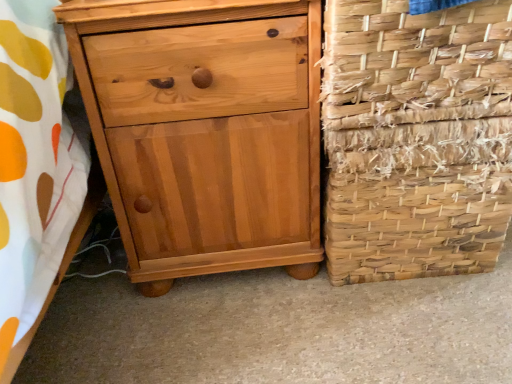
Question: Does light brown wood chest of drawers at left have a lesser width compared to woven natural fiber basket at right?

Choices:
 (A) yes
 (B) no

Answer: (B)

Question: Is light brown wood chest of drawers at left positioned before woven natural fiber basket at right?

Choices:
 (A) yes
 (B) no

Answer: (A)

Question: From the image's perspective, does light brown wood chest of drawers at left appear higher than woven natural fiber basket at right?

Choices:
 (A) yes
 (B) no

Answer: (A)

Question: Does light brown wood chest of drawers at left appear on the left side of woven natural fiber basket at right?

Choices:
 (A) yes
 (B) no

Answer: (A)

Question: From a real-world perspective, is light brown wood chest of drawers at left physically above woven natural fiber basket at right?

Choices:
 (A) no
 (B) yes

Answer: (B)

Question: Is woven natural fiber basket at right completely or partially inside light brown wood chest of drawers at left?

Choices:
 (A) yes
 (B) no

Answer: (B)

Question: Can you confirm if woven straw basket at right is wider than light brown wood chest of drawers at left?

Choices:
 (A) no
 (B) yes

Answer: (A)

Question: Is woven straw basket at right far from light brown wood chest of drawers at left?

Choices:
 (A) yes
 (B) no

Answer: (B)

Question: Is the position of woven straw basket at right less distant than that of light brown wood chest of drawers at left?

Choices:
 (A) no
 (B) yes

Answer: (B)

Question: Does woven straw basket at right touch light brown wood chest of drawers at left?

Choices:
 (A) no
 (B) yes

Answer: (A)

Question: Is woven straw basket at right smaller than light brown wood chest of drawers at left?

Choices:
 (A) yes
 (B) no

Answer: (A)

Question: From the image's perspective, is woven straw basket at right under light brown wood chest of drawers at left?

Choices:
 (A) yes
 (B) no

Answer: (B)

Question: Is woven natural fiber basket at right a part of woven straw basket at right?

Choices:
 (A) yes
 (B) no

Answer: (B)